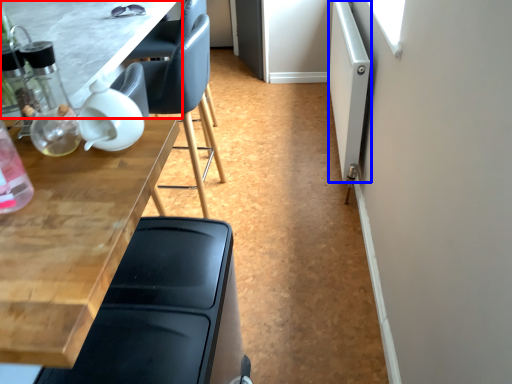
Question: Which point is closer to the camera, table (highlighted by a red box) or screen door (highlighted by a blue box)?

Choices:
 (A) table
 (B) screen door

Answer: (A)